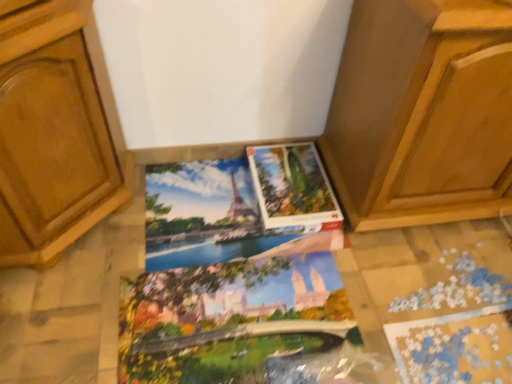
Find the location of a particular element. free region under matte paper coloring book at center, marked as the first coloring book in a bottom-to-top arrangement (from a real-world perspective) is located at coordinates (230, 313).